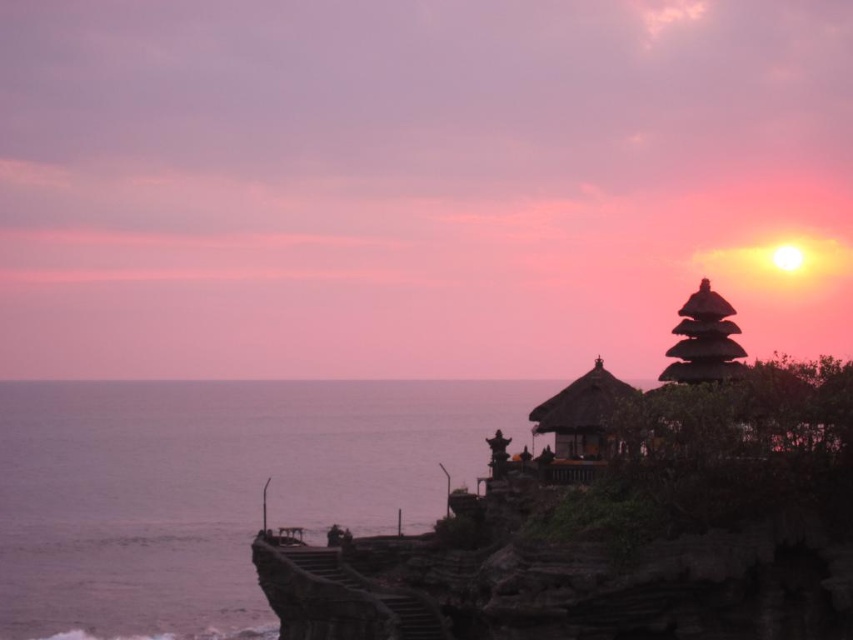
Question: Which is nearer to the dark brown wooden gazebo at upper right?

Choices:
 (A) silvery water at lower left
 (B) matte brown gazebo at center

Answer: (B)

Question: Which object is closer to the camera taking this photo?

Choices:
 (A) matte brown gazebo at center
 (B) dark brown wooden gazebo at upper right
 (C) silvery water at lower left

Answer: (A)

Question: Is silvery water at lower left positioned in front of dark brown wooden gazebo at upper right?

Choices:
 (A) no
 (B) yes

Answer: (A)

Question: Does silvery water at lower left appear under dark brown wooden gazebo at upper right?

Choices:
 (A) yes
 (B) no

Answer: (A)

Question: Which point is farther from the camera taking this photo?

Choices:
 (A) (596, 426)
 (B) (200, 426)

Answer: (B)

Question: Can you confirm if silvery water at lower left is positioned above matte brown gazebo at center?

Choices:
 (A) yes
 (B) no

Answer: (B)